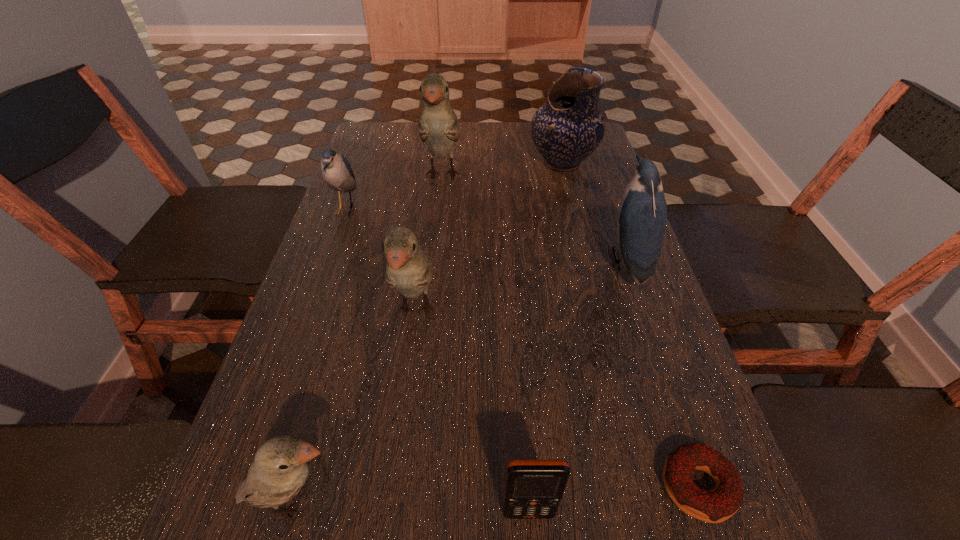
Identify the location of free space located 0.290m at the tip of the left blue bird's beak. (468, 209).

Image resolution: width=960 pixels, height=540 pixels. Find the location of `blank space located at the face of the nearest white bird`. blank space located at the face of the nearest white bird is located at coordinates (608, 501).

The width and height of the screenshot is (960, 540). Find the location of `free space located on the back of the shortest object`. free space located on the back of the shortest object is located at coordinates (665, 389).

Identify the location of bird at the far edge. (438, 127).

The width and height of the screenshot is (960, 540). Find the location of `pottery located in the far edge section of the desktop`. pottery located in the far edge section of the desktop is located at coordinates (568, 128).

At what (x,y) coordinates should I click in order to perform the action: click on pottery that is at the right edge. Please return your answer as a coordinate pair (x, y). The image size is (960, 540). Looking at the image, I should click on click(568, 128).

Find the location of a particular element. The width and height of the screenshot is (960, 540). bird at the right edge is located at coordinates (642, 213).

Find the location of a particular element. The image size is (960, 540). doughnut that is at the right edge is located at coordinates (717, 505).

Find the location of `object that is at the far right corner`. object that is at the far right corner is located at coordinates (568, 128).

Locate an element on the screen. The image size is (960, 540). vacant space at the far edge of the desktop is located at coordinates (471, 156).